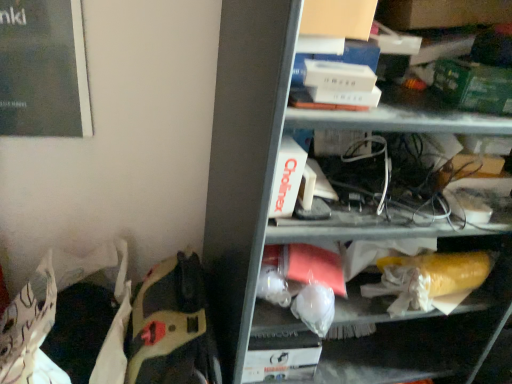
The image size is (512, 384). Describe the element at coordinates (474, 86) in the screenshot. I see `green matte paperback book at upper right` at that location.

At what (x,y) coordinates should I click in order to perform the action: click on green matte paperback book at upper right. Please return your answer as a coordinate pair (x, y). This screenshot has height=384, width=512. Looking at the image, I should click on (474, 86).

Where is `green matte paperback book at upper right`? green matte paperback book at upper right is located at coordinates (474, 86).